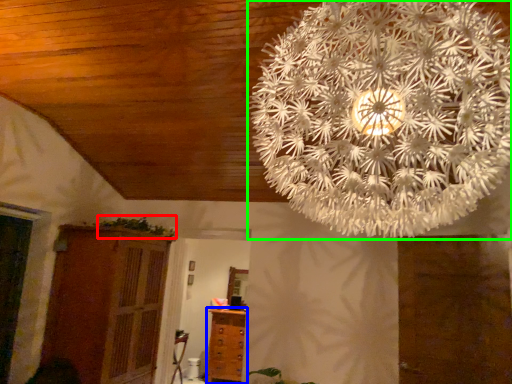
Question: Based on their relative distances, which object is nearer to plant (highlighted by a red box)? Choose from chest of drawers (highlighted by a blue box) and lamp (highlighted by a green box).

Choices:
 (A) chest of drawers
 (B) lamp

Answer: (A)